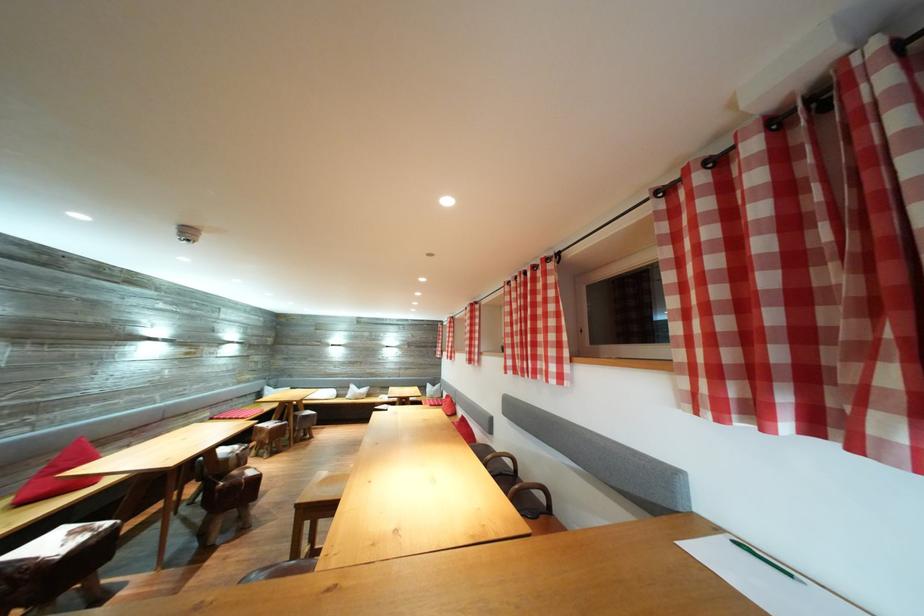
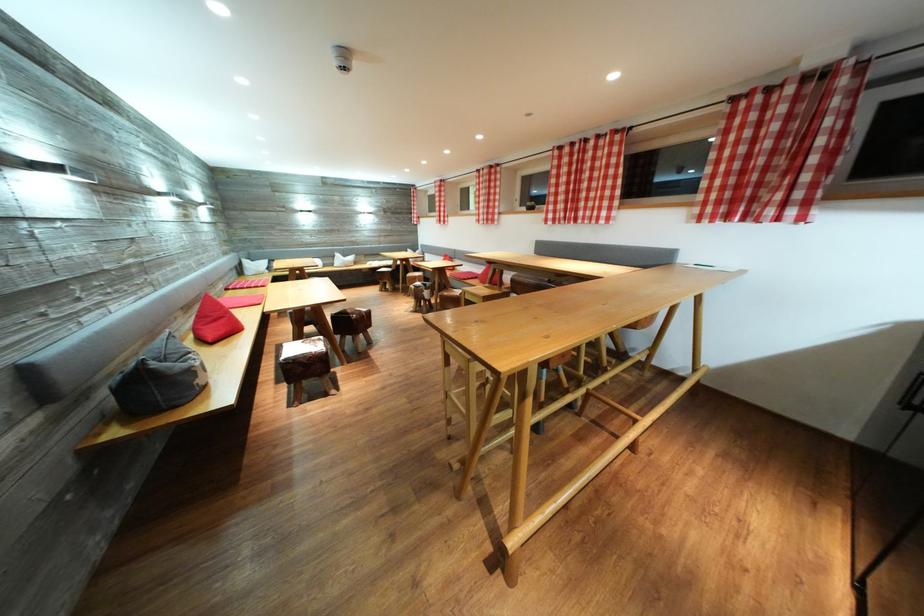
The point at (91,536) is marked in the first image. Where is the corresponding point in the second image?

(321, 346)